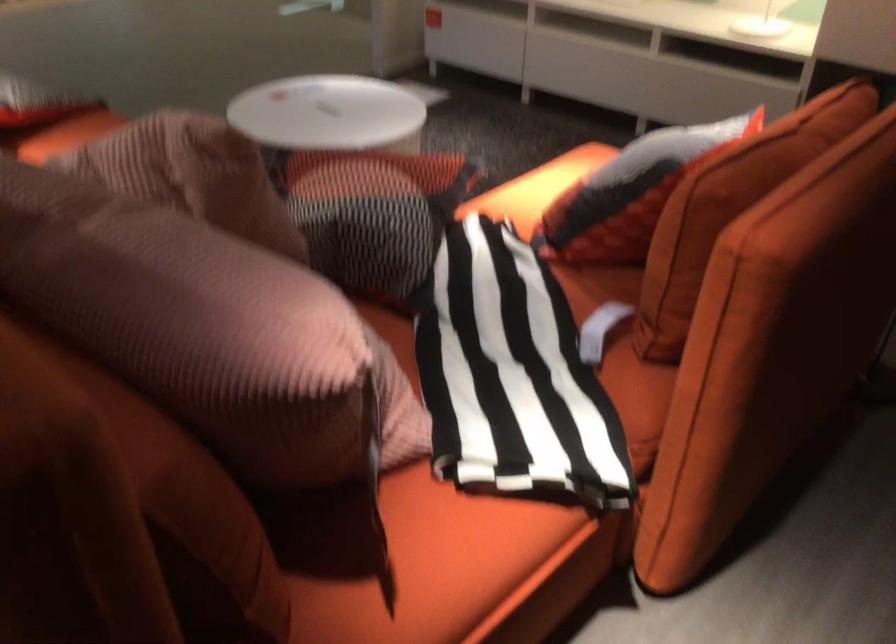
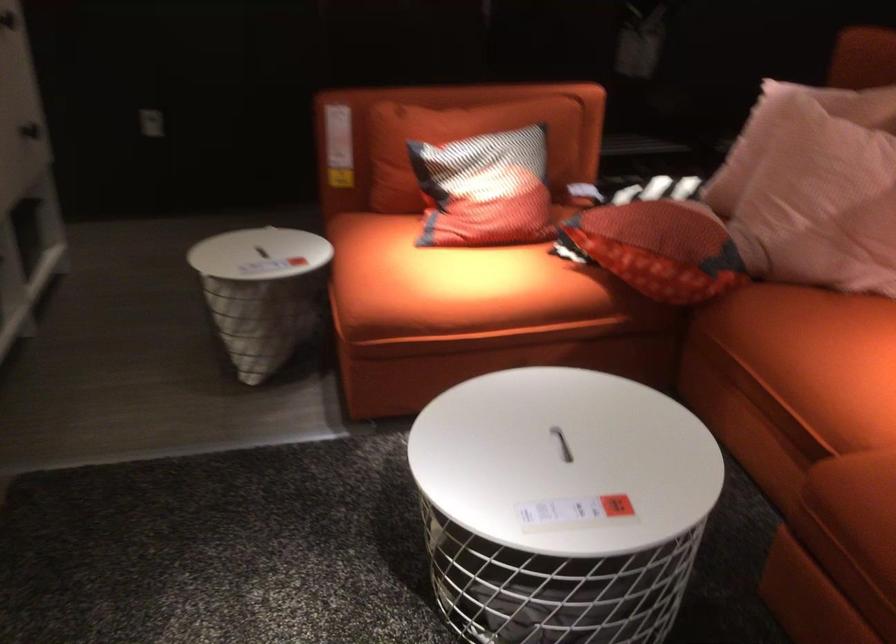
Question: I am providing you with two images of the same scene from different viewpoints. Please identify which objects are invisible in image2.

Choices:
 (A) orange sofa sitting surface
 (B) red patterned pillow
 (C) sofa armrest
 (D) tan container

Answer: (C)